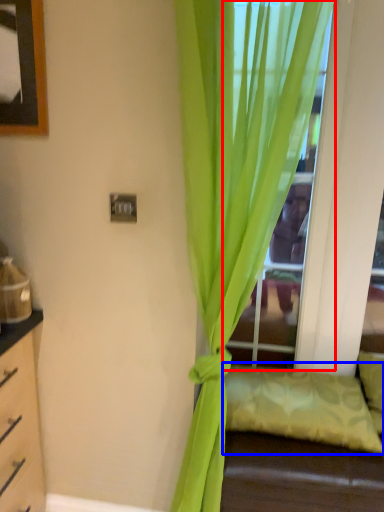
Question: Among these objects, which one is nearest to the camera, glass door (highlighted by a red box) or pillow (highlighted by a blue box)?

Choices:
 (A) glass door
 (B) pillow

Answer: (B)